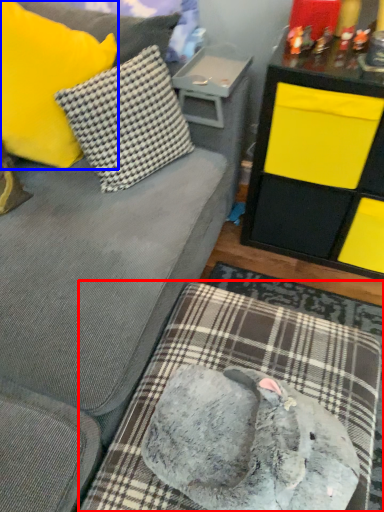
Question: Among these objects, which one is nearest to the camera, dog bed (highlighted by a red box) or pillow (highlighted by a blue box)?

Choices:
 (A) dog bed
 (B) pillow

Answer: (A)